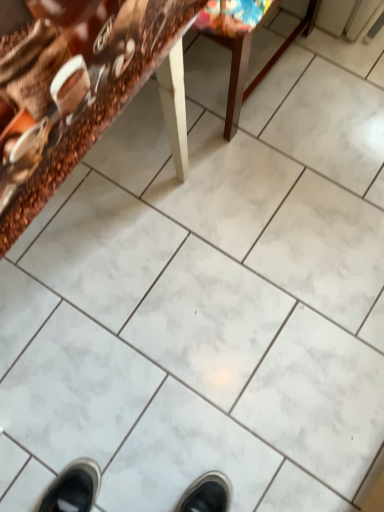
Image resolution: width=384 pixels, height=512 pixels. Find the location of `wooden armchair at upper center`. wooden armchair at upper center is located at coordinates (248, 61).

This screenshot has width=384, height=512. Describe the element at coordinates (248, 61) in the screenshot. I see `wooden armchair at upper center` at that location.

What is the approximate height of wooden armchair at upper center?

20.50 inches.

Identify the location of wooden armchair at upper center. (248, 61).